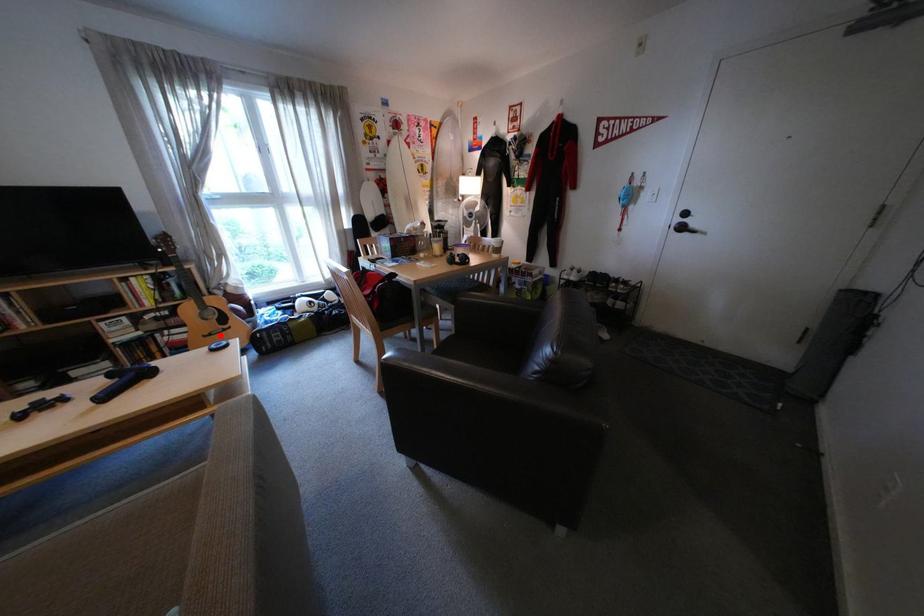
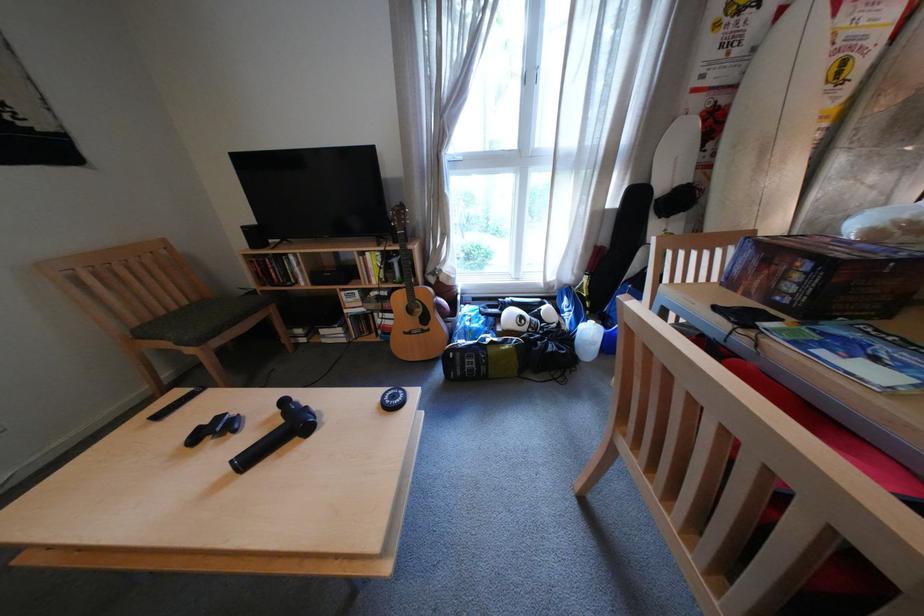
Question: I am providing you with two images of the same scene from different viewpoints. Given a red point in image1, look at the same physical point in image2. Is it:

Choices:
 (A) Closer to the viewpoint
 (B) Farther from the viewpoint

Answer: (B)